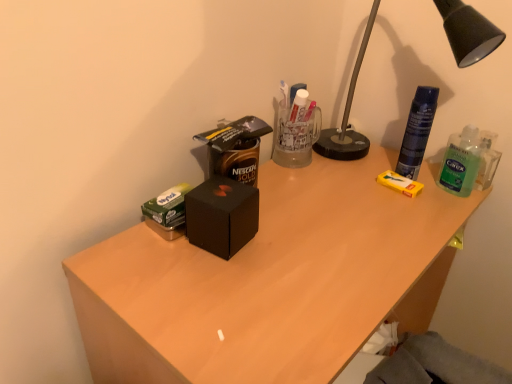
You are a GUI agent. You are given a task and a screenshot of the screen. Output one action in this format:
    pyautogui.click(x=<x>, y=<y>)
    Task: Click on the free spot in front of green translucent hand sanitizer at right
    Image resolution: width=512 pixels, height=384 pixels.
    Given the screenshot: What is the action you would take?
    pyautogui.click(x=443, y=217)